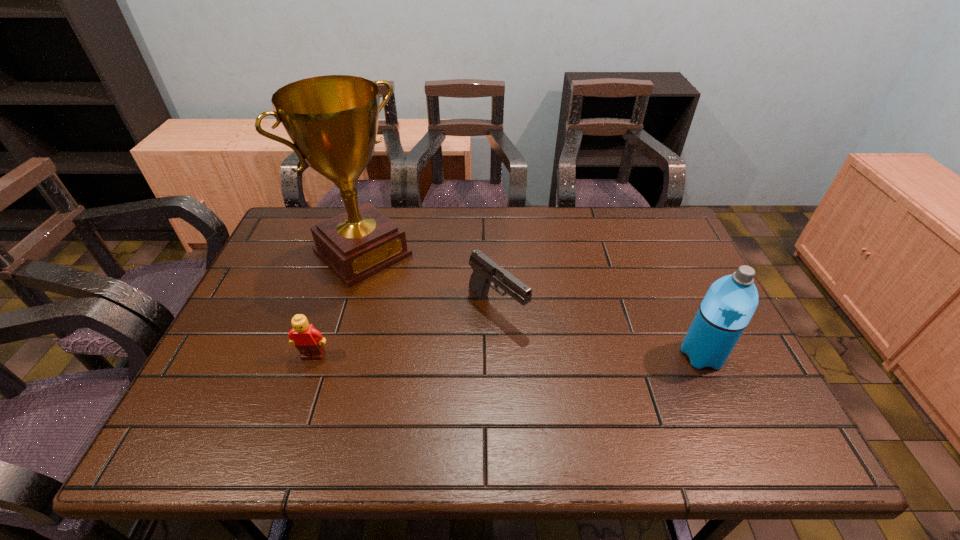
In the image, there is a desktop. What are the coordinates of `free region at the far left corner` in the screenshot? It's located at (325, 209).

Locate an element on the screen. Image resolution: width=960 pixels, height=540 pixels. vacant space that is in between the second object from right to left and the award is located at coordinates (430, 281).

Identify the location of free point between the Lego and the third object from left to right. (405, 332).

Identify the location of empty space that is in between the tallest object and the thermos bottle. pyautogui.click(x=532, y=304).

The image size is (960, 540). I want to click on vacant area between the award and the Lego, so click(x=338, y=304).

Find the location of `free spot between the tallest object and the second object from right to left`. free spot between the tallest object and the second object from right to left is located at coordinates (430, 281).

At what (x,y) coordinates should I click in order to perform the action: click on free spot between the tallest object and the thermos bottle. Please return your answer as a coordinate pair (x, y). Looking at the image, I should click on (x=532, y=304).

The image size is (960, 540). Find the location of `free spot between the pistol and the Lego`. free spot between the pistol and the Lego is located at coordinates (405, 332).

Find the location of `free space between the Lego and the pistol`. free space between the Lego and the pistol is located at coordinates (405, 332).

Identify the location of free space between the thermos bottle and the second object from right to left. (600, 332).